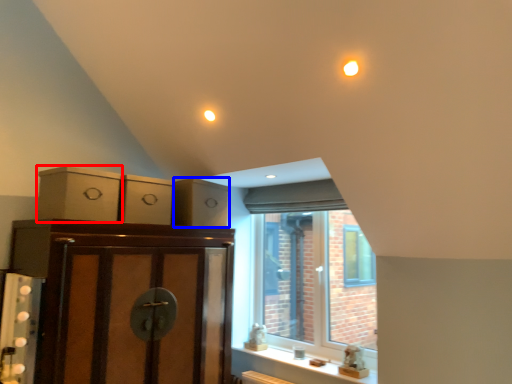
Question: Among these objects, which one is farthest to the camera, cabinetry (highlighted by a red box) or drawer (highlighted by a blue box)?

Choices:
 (A) cabinetry
 (B) drawer

Answer: (B)